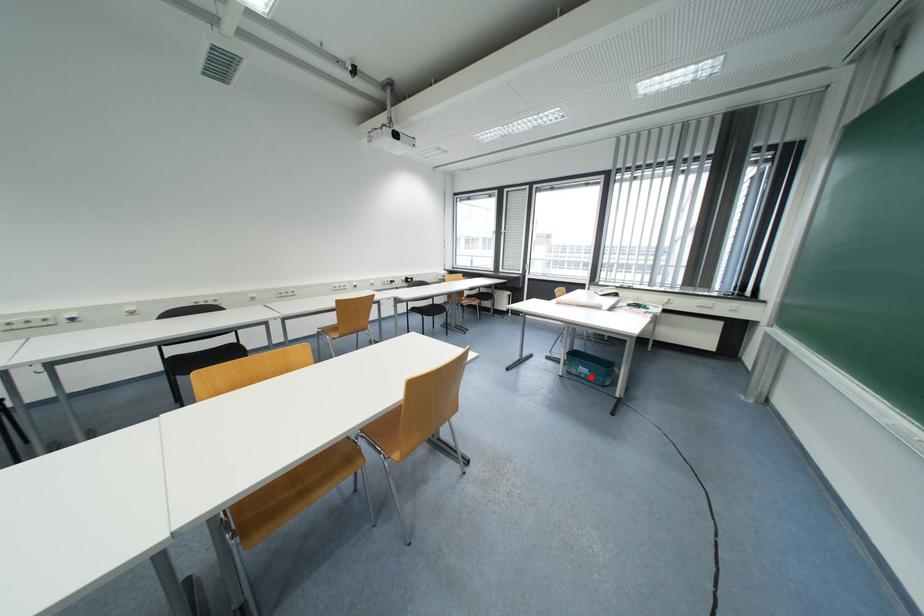
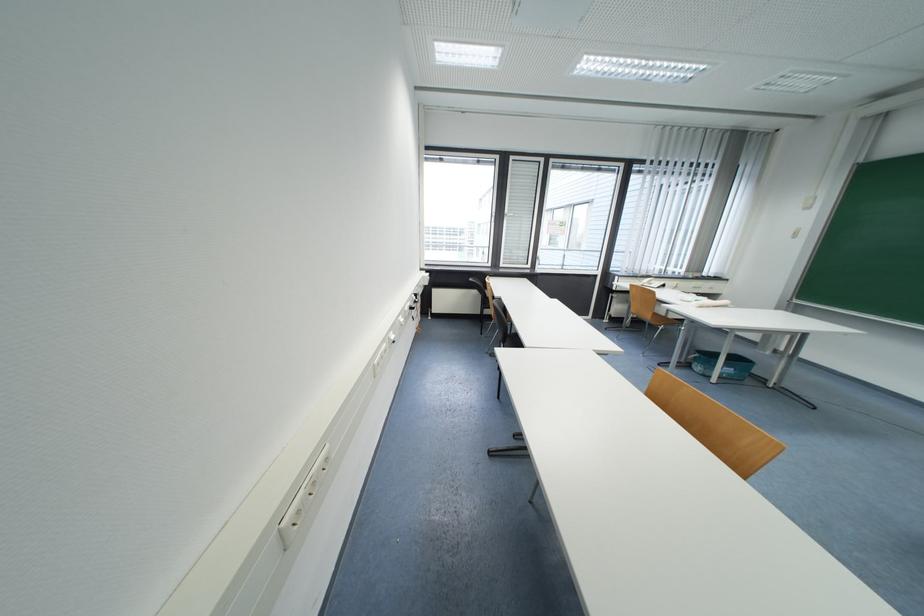
Question: I am providing you with two images of the same scene from different viewpoints. In image1, a red point is highlighted. Considering the same 3D point in image2, which of the following is correct?

Choices:
 (A) It is closer
 (B) It is farther

Answer: (B)